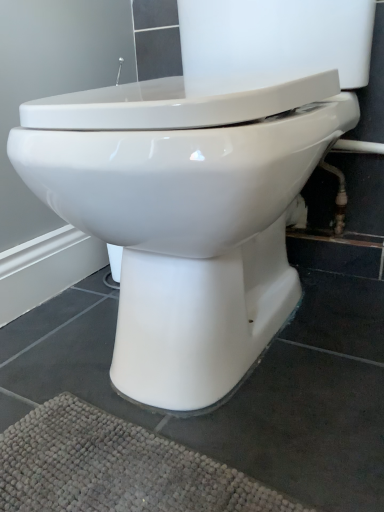
This screenshot has width=384, height=512. I want to click on white glossy toilet at center, so click(186, 216).

The image size is (384, 512). Describe the element at coordinates (186, 216) in the screenshot. I see `white glossy toilet at center` at that location.

Locate an element on the screen. Image resolution: width=384 pixels, height=512 pixels. white glossy toilet at center is located at coordinates tap(186, 216).